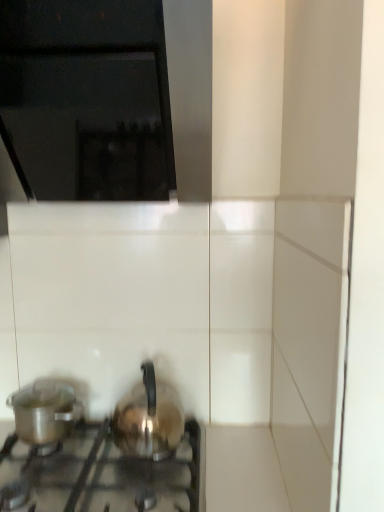
Question: Is black glass vent at upper left taller or shorter than shiny metallic kettle at center, the first kitchen appliance in the right-to-left sequence?

Choices:
 (A) tall
 (B) short

Answer: (A)

Question: Considering the positions of black glass vent at upper left and shiny metallic kettle at center, the second kitchen appliance viewed from the left, in the image, is black glass vent at upper left wider or thinner than shiny metallic kettle at center, the second kitchen appliance viewed from the left,?

Choices:
 (A) wide
 (B) thin

Answer: (A)

Question: Which is nearer to the satin silver kettle at lower left?

Choices:
 (A) shiny metallic kettle at center, the first kitchen appliance in the right-to-left sequence
 (B) black glass vent at upper left
 (C) metallic silver pot at lower left, which is the first kitchen appliance from left to right

Answer: (A)

Question: Which object is positioned closest to the metallic silver pot at lower left, which is the first kitchen appliance from left to right?

Choices:
 (A) black glass vent at upper left
 (B) satin silver kettle at lower left
 (C) shiny metallic kettle at center, the first kitchen appliance in the right-to-left sequence

Answer: (B)